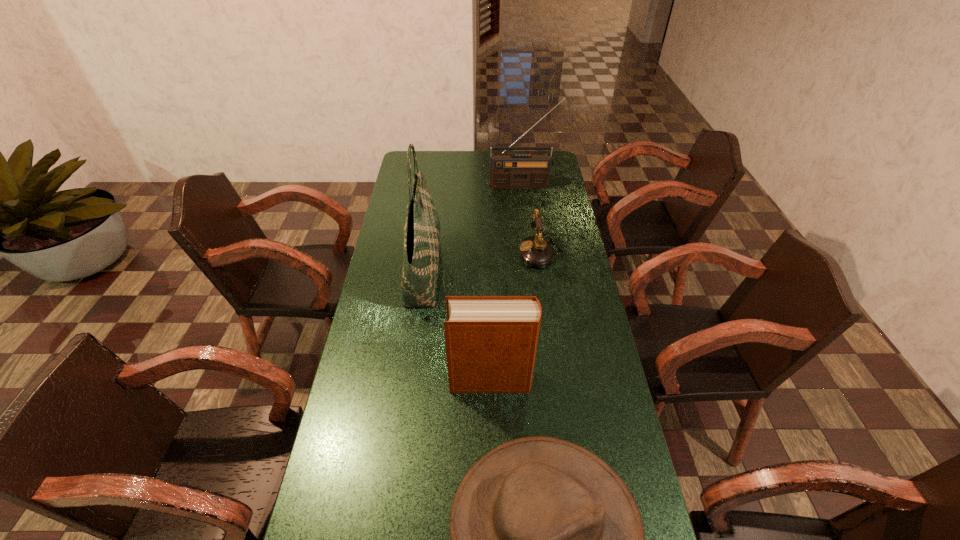
You are a GUI agent. You are given a task and a screenshot of the screen. Output one action in this format:
    pyautogui.click(x=<x>, y=<y>)
    Task: Click on the tallest object
    
    Given the screenshot: What is the action you would take?
    pyautogui.click(x=422, y=226)

Locate an element on the screen. the leftmost object is located at coordinates (422, 226).

The width and height of the screenshot is (960, 540). Find the location of `the second tallest object`. the second tallest object is located at coordinates (507, 171).

Identify the location of the farthest object. (507, 171).

Where is `the fourth farthest object`? the fourth farthest object is located at coordinates (491, 341).

Identify the location of hardback book. (491, 341).

I want to click on telephone, so click(x=535, y=251).

Find the location of a particular element. vacant space located on the right of the leftmost object is located at coordinates point(467,271).

This screenshot has height=540, width=960. What are the coordinates of `free space located 0.210m on the front-facing side of the radio receiver` in the screenshot? It's located at (526, 215).

Where is `free spot located 0.250m on the open cover of the hardback book`? The width and height of the screenshot is (960, 540). free spot located 0.250m on the open cover of the hardback book is located at coordinates (369, 380).